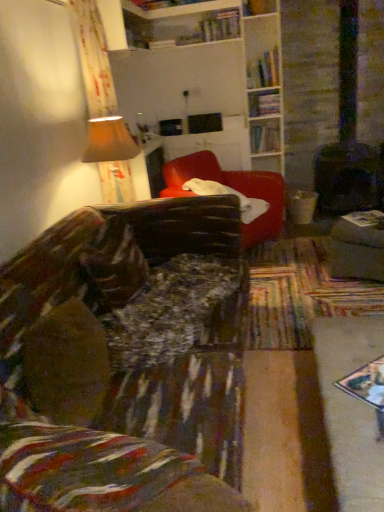
Question: In which direction should I rotate to look at wooden bookshelf at upper center, positioned as the second shelf in bottom-to-top order?

Choices:
 (A) left
 (B) right

Answer: (B)

Question: From a real-world perspective, is matte gray ottoman at right positioned over hardcover book at upper center, which ranks as the fourth book in bottom-to-top order, based on gravity?

Choices:
 (A) no
 (B) yes

Answer: (A)

Question: Is matte gray ottoman at right facing towards hardcover book at upper center, the 2th book in the back-to-front sequence?

Choices:
 (A) yes
 (B) no

Answer: (B)

Question: Considering the relative positions of matte gray ottoman at right and hardcover book at upper center, marked as the first book in a left-to-right arrangement, in the image provided, is matte gray ottoman at right to the right of hardcover book at upper center, marked as the first book in a left-to-right arrangement, from the viewer's perspective?

Choices:
 (A) no
 (B) yes

Answer: (B)

Question: Is matte gray ottoman at right turned away from hardcover book at upper center, placed as the 1th book when sorted from top to bottom?

Choices:
 (A) yes
 (B) no

Answer: (B)

Question: Is matte gray ottoman at right taller than hardcover book at upper center, marked as the first book in a left-to-right arrangement?

Choices:
 (A) yes
 (B) no

Answer: (A)

Question: Considering the relative sizes of matte gray ottoman at right and hardcover book at upper center, the 3th book when ordered from front to back, in the image provided, is matte gray ottoman at right thinner than hardcover book at upper center, the 3th book when ordered from front to back,?

Choices:
 (A) yes
 (B) no

Answer: (B)

Question: Does white paper book at right, which is the 4th book from top to bottom, turn towards hardcover books at upper right, which is counted as the 2th book, starting from the front?

Choices:
 (A) yes
 (B) no

Answer: (B)

Question: From the image's perspective, is white paper book at right, placed as the 1th book when sorted from bottom to top, below hardcover books at upper right, which is the third book in right-to-left order?

Choices:
 (A) yes
 (B) no

Answer: (A)

Question: Is the depth of white paper book at right, which is the 4th book from top to bottom, greater than that of hardcover books at upper right, which appears as the second book when viewed from the top?

Choices:
 (A) yes
 (B) no

Answer: (B)

Question: Considering the relative sizes of white paper book at right, the 4th book positioned from the back, and hardcover books at upper right, which is counted as the 2th book, starting from the front, in the image provided, is white paper book at right, the 4th book positioned from the back, bigger than hardcover books at upper right, which is counted as the 2th book, starting from the front,?

Choices:
 (A) no
 (B) yes

Answer: (A)

Question: Is white paper book at right, the 4th book from the left, positioned far away from hardcover books at upper right, which is counted as the 3th book, starting from the back?

Choices:
 (A) yes
 (B) no

Answer: (A)

Question: Considering the relative sizes of white paper book at right, the 4th book positioned from the back, and hardcover books at upper right, the 3th book in the bottom-to-top sequence, in the image provided, is white paper book at right, the 4th book positioned from the back, thinner than hardcover books at upper right, the 3th book in the bottom-to-top sequence,?

Choices:
 (A) no
 (B) yes

Answer: (B)

Question: From a real-world perspective, is matte beige lampshade at upper left located beneath hardcover book at upper center, arranged as the fourth book when viewed from the right?

Choices:
 (A) yes
 (B) no

Answer: (A)